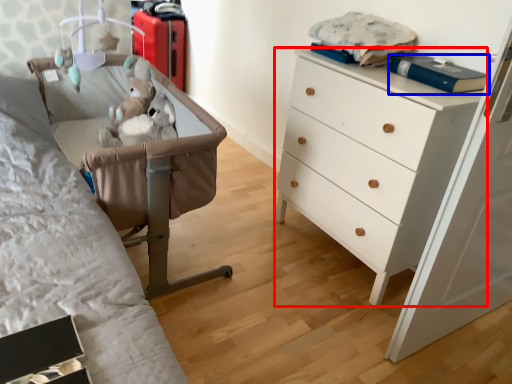
Question: Which object appears farthest to the camera in this image, chest of drawers (highlighted by a red box) or book (highlighted by a blue box)?

Choices:
 (A) chest of drawers
 (B) book

Answer: (B)